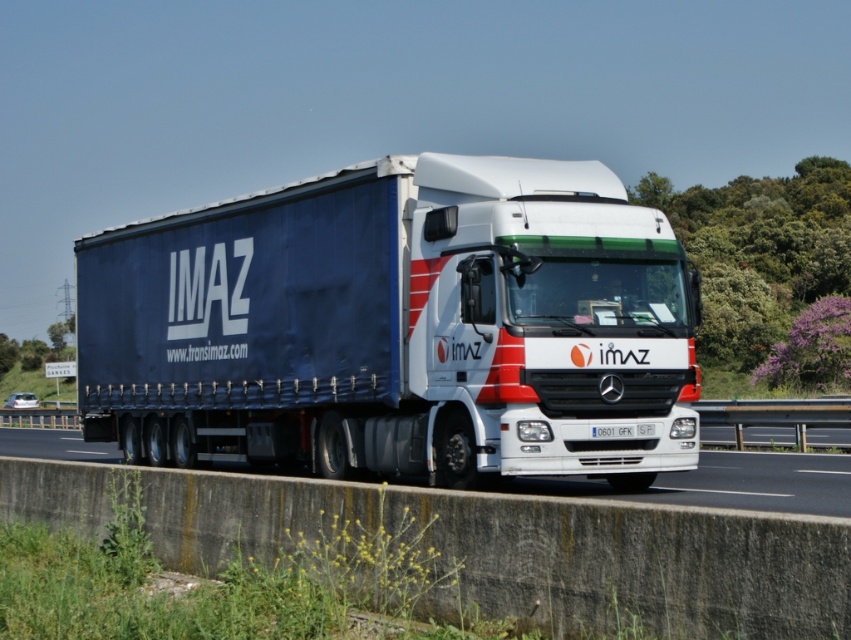
From the picture: You are a photographer trying to capture the blue fabric trailer truck at center and the white plastic license plate at center in a single shot. Considering their sizes, which object will appear larger in the photo?

The blue fabric trailer truck at center will appear larger in the photo because its width is larger than the white plastic license plate at center.

You are a driver observing the road ahead. You see the concrete barrier at lower center and the white plastic license plate at center. Which object is positioned to the left of the other?

The concrete barrier at lower center is to the left of the white plastic license plate at center.